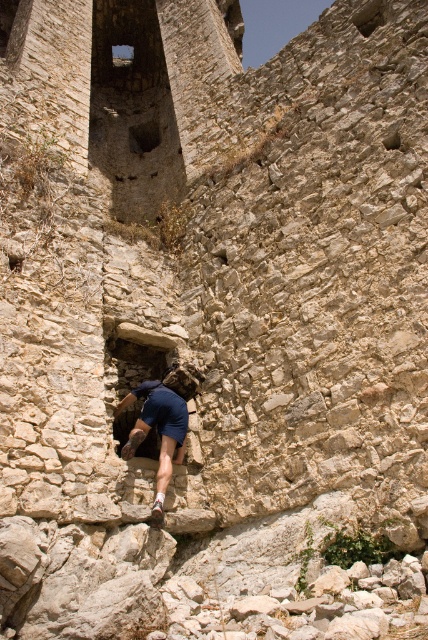
Question: Which of the following is the farthest from the observer?

Choices:
 (A) click(x=157, y=122)
 (B) click(x=118, y=371)
 (C) click(x=160, y=492)

Answer: (A)

Question: Can you confirm if dark blue fabric at center is wider than stone hole at center?

Choices:
 (A) no
 (B) yes

Answer: (B)

Question: Considering the relative positions of dark blue fabric at center and dark stone hole at upper center in the image provided, where is dark blue fabric at center located with respect to dark stone hole at upper center?

Choices:
 (A) below
 (B) above

Answer: (A)

Question: Which object is closer to the camera taking this photo?

Choices:
 (A) stone hole at center
 (B) dark stone hole at upper center

Answer: (A)

Question: Which object appears farthest from the camera in this image?

Choices:
 (A) dark blue fabric at center
 (B) dark stone hole at upper center
 (C) stone hole at center

Answer: (B)

Question: Is dark blue fabric at center below stone hole at center?

Choices:
 (A) no
 (B) yes

Answer: (B)